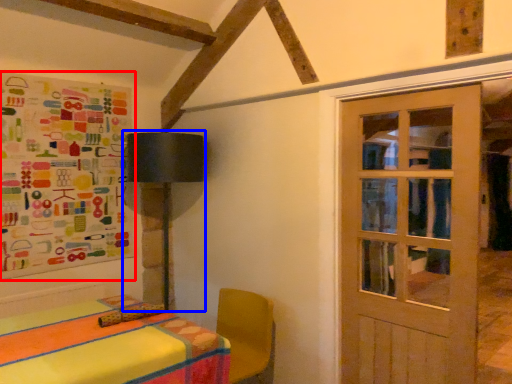
Question: Among these objects, which one is farthest to the camera, bulletin board (highlighted by a red box) or table lamp (highlighted by a blue box)?

Choices:
 (A) bulletin board
 (B) table lamp

Answer: (B)